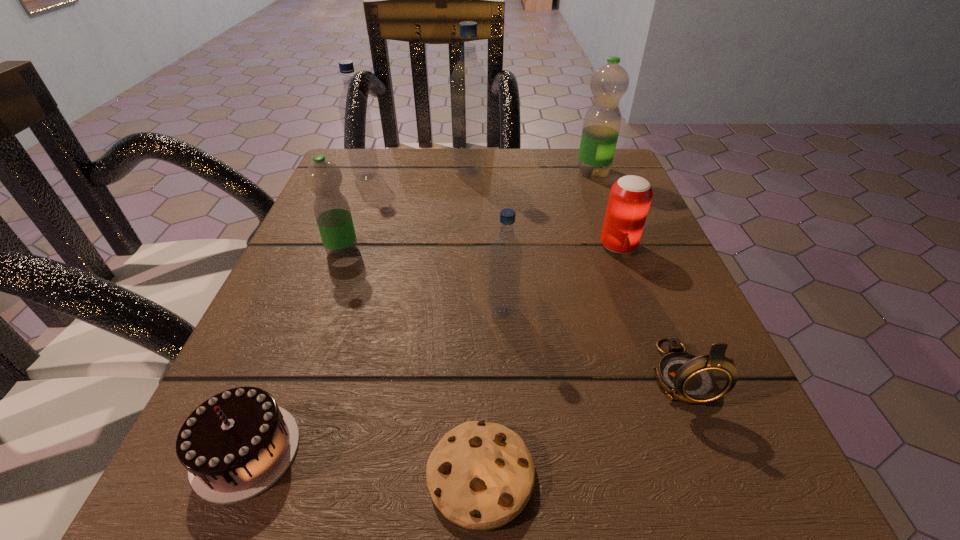
Identify the location of the seventh tallest object. This screenshot has width=960, height=540. (684, 377).

At what (x,y) coordinates should I click in order to perform the action: click on chocolate cake. Please return your answer as a coordinate pair (x, y). The width and height of the screenshot is (960, 540). Looking at the image, I should click on (238, 443).

Where is `cookie`? cookie is located at coordinates (481, 475).

The image size is (960, 540). Identify the location of brown cookie. (481, 475).

The width and height of the screenshot is (960, 540). In order to click on vacant area situated on the left of the tallest object in this screenshot , I will do `click(382, 172)`.

Where is `vacant space located 0.050m on the front of the right green water bottle`? vacant space located 0.050m on the front of the right green water bottle is located at coordinates (601, 192).

Locate an element on the screen. The height and width of the screenshot is (540, 960). free space located on the front of the leftmost blue water bottle is located at coordinates (327, 280).

Image resolution: width=960 pixels, height=540 pixels. In order to click on vacant space located 0.180m on the right of the fourth nearest object in this screenshot , I will do `click(636, 312)`.

The image size is (960, 540). I want to click on vacant space located on the back of the smaller green water bottle, so click(x=375, y=160).

I want to click on free point located on the left of the beer can, so click(438, 246).